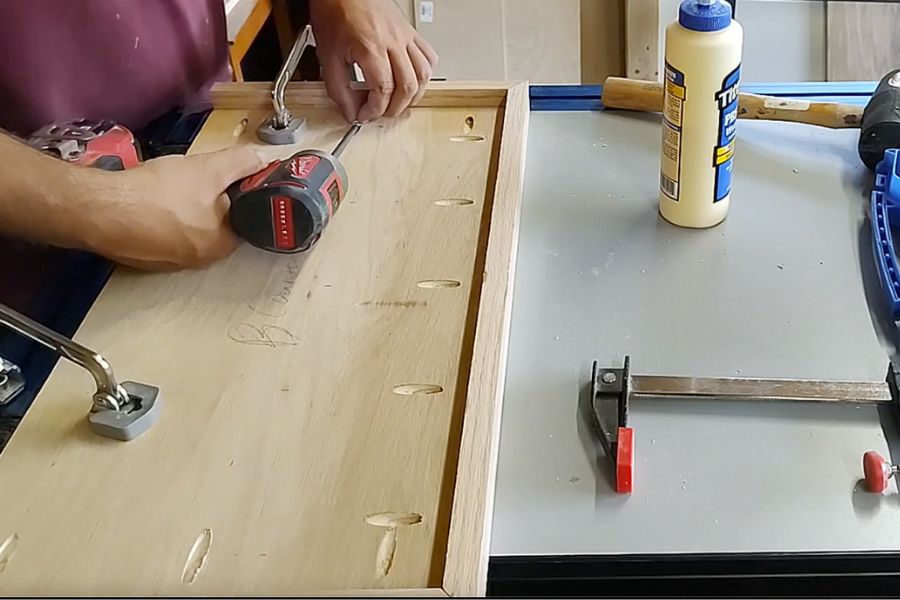
Where is `table`? This screenshot has height=600, width=900. table is located at coordinates tap(547, 329).